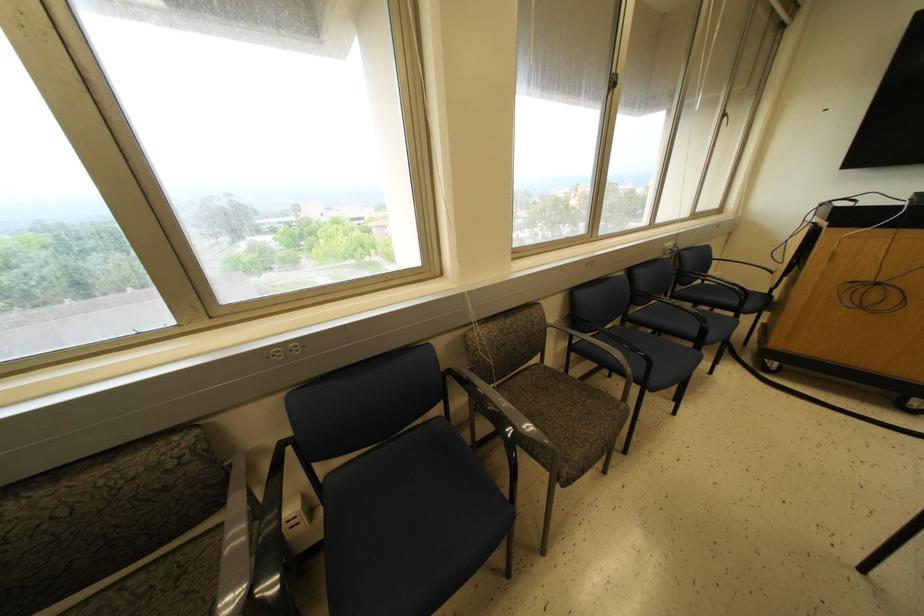
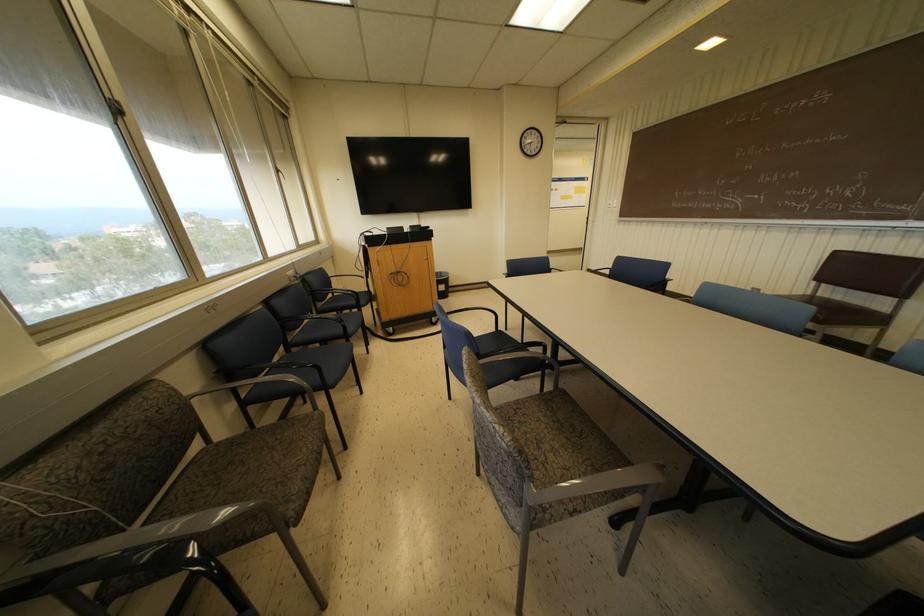
Where in the second image is the point corresponding to pixel 647 358 from the first image?

(313, 366)